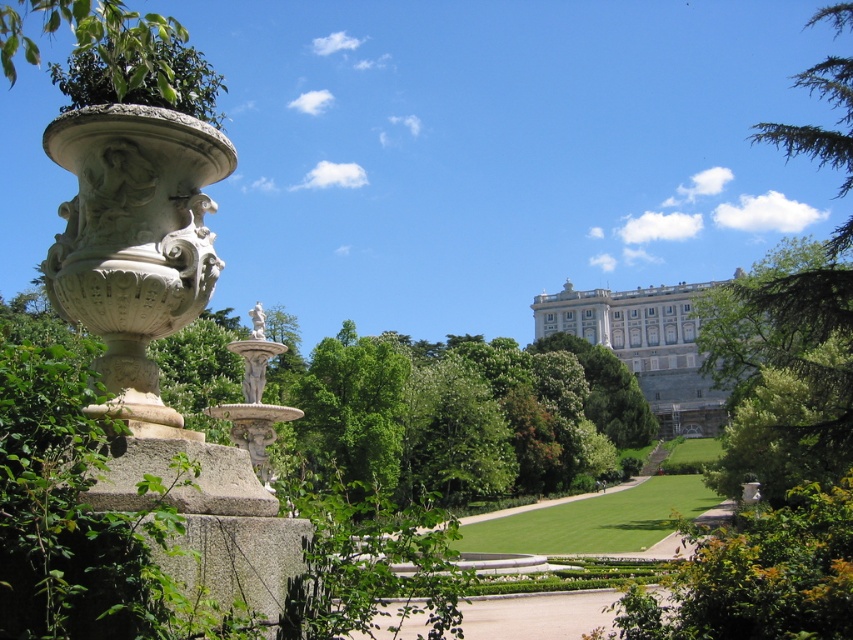
Does green leafy tree at upper right have a greater height compared to white marble statue at center?

Correct, green leafy tree at upper right is much taller as white marble statue at center.

Consider the image. Between green leafy tree at upper right and white marble statue at center, which one has less height?

white marble statue at center is shorter.

Identify the location of green leafy tree at upper right. (784, 365).

Find the location of a particular element. Image resolution: width=853 pixels, height=640 pixels. green leafy tree at upper right is located at coordinates (784, 365).

Is white stone palace at upper center closer to camera compared to white marble statue at center?

That is False.

Between white stone palace at upper center and white marble statue at center, which one has less height?

With less height is white marble statue at center.

I want to click on white stone palace at upper center, so (x=645, y=346).

Where is `green leafy tree at upper right`? The width and height of the screenshot is (853, 640). green leafy tree at upper right is located at coordinates (784, 365).

Who is higher up, green leafy tree at upper right or white stone palace at upper center?

green leafy tree at upper right is higher up.

Which is behind, point (840, 4) or point (689, 340)?

The point (689, 340) is more distant.

Where is `green leafy tree at upper right`? The width and height of the screenshot is (853, 640). green leafy tree at upper right is located at coordinates (784, 365).